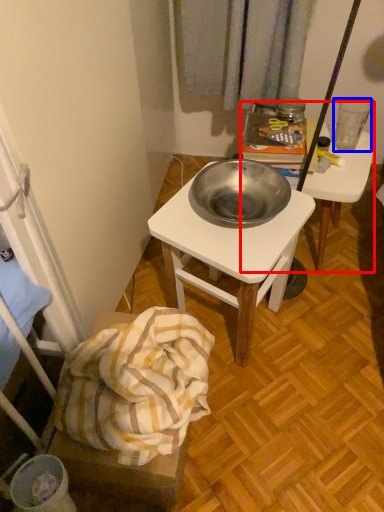
Question: Which object is closer to the camera taking this photo, desk (highlighted by a red box) or coffee cup (highlighted by a blue box)?

Choices:
 (A) desk
 (B) coffee cup

Answer: (A)